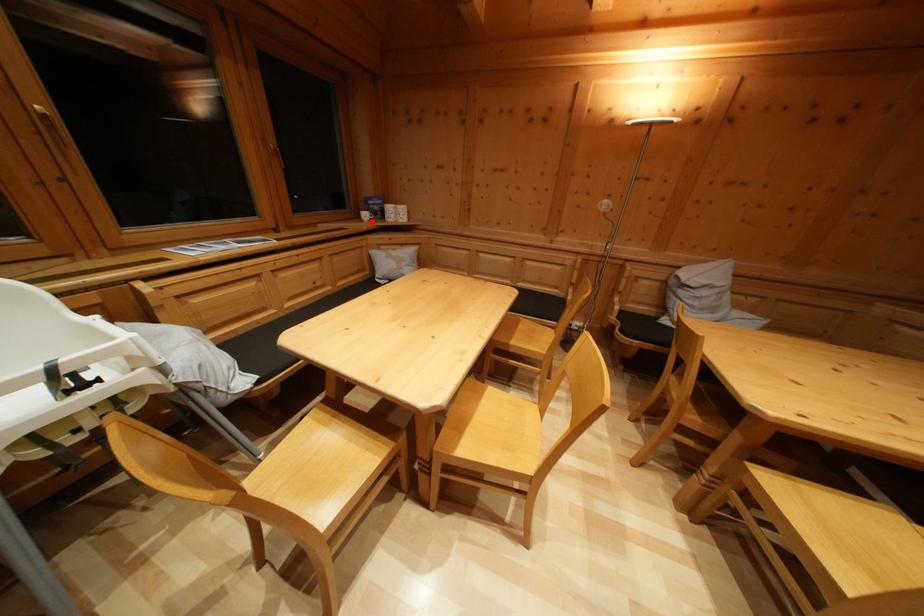
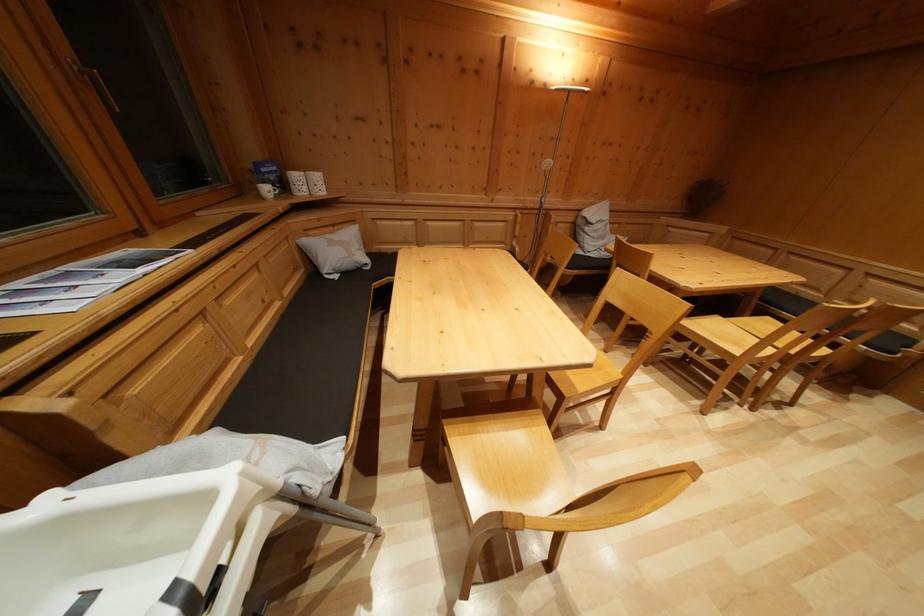
Question: I am providing you with two images of the same scene from different viewpoints. Image1 has a red point marked. In image2, the corresponding 3D location appears at what relative position? Reply with the corresponding letter.

Choices:
 (A) Closer
 (B) Farther

Answer: (B)